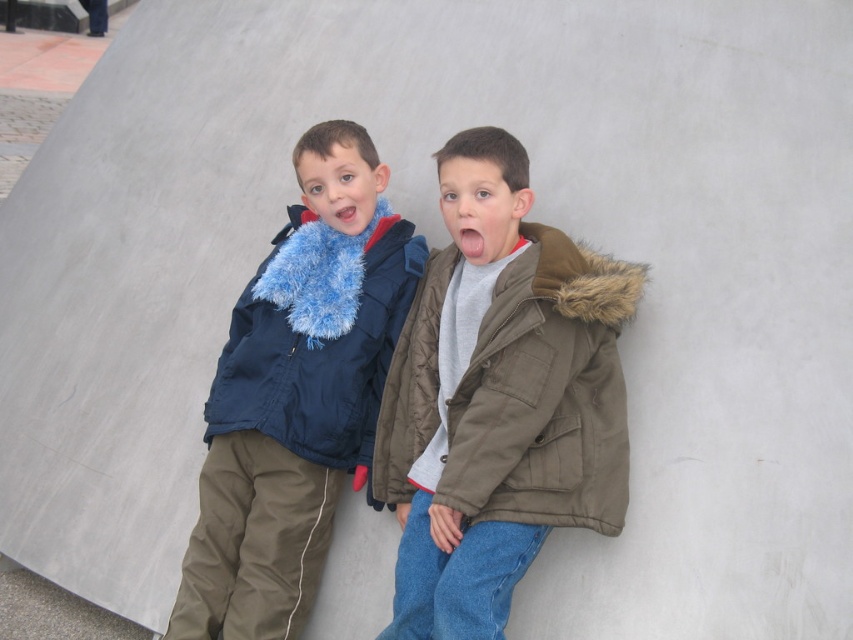
Can you confirm if matte blue scarf at left is bigger than olive green quilted jacket at center?

Correct, matte blue scarf at left is larger in size than olive green quilted jacket at center.

Is point (277, 316) positioned before point (569, 346)?

No.

Image resolution: width=853 pixels, height=640 pixels. I want to click on matte blue scarf at left, so click(297, 394).

Is olive green quilted jacket at center bigger than matte blue fur at left?

Yes.

Does olive green quilted jacket at center appear under matte blue fur at left?

Correct, olive green quilted jacket at center is located below matte blue fur at left.

What do you see at coordinates (544, 392) in the screenshot? I see `olive green quilted jacket at center` at bounding box center [544, 392].

The height and width of the screenshot is (640, 853). In order to click on olive green quilted jacket at center in this screenshot , I will do coord(544,392).

From the picture: Does matte blue scarf at left have a greater height compared to matte blue fur at left?

Correct, matte blue scarf at left is much taller as matte blue fur at left.

Does matte blue scarf at left appear under matte blue fur at left?

Yes.

Who is more forward, [238,300] or [234,424]?

Point [234,424] is more forward.

Where is `matte blue scarf at left`? The width and height of the screenshot is (853, 640). matte blue scarf at left is located at coordinates (297, 394).